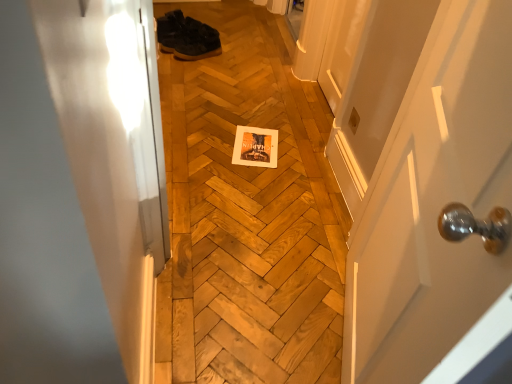
Question: Considering the positions of dark brown leather shoes at upper center and wooden at center in the image, is dark brown leather shoes at upper center taller or shorter than wooden at center?

Choices:
 (A) short
 (B) tall

Answer: (B)

Question: In the image, is dark brown leather shoes at upper center on the left side or the right side of wooden at center?

Choices:
 (A) left
 (B) right

Answer: (A)

Question: Estimate the real-world distances between objects in this image. Which object is closer to the white glossy door at center?

Choices:
 (A) dark brown leather shoes at upper center
 (B) wooden at center

Answer: (B)

Question: Estimate the real-world distances between objects in this image. Which object is farther from the dark brown leather shoes at upper center?

Choices:
 (A) white glossy door at center
 (B) wooden at center

Answer: (A)